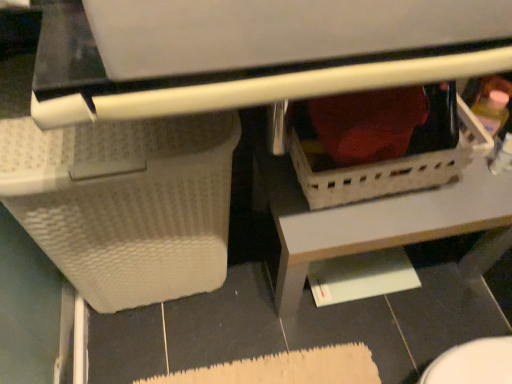
The height and width of the screenshot is (384, 512). In order to click on free point to the right of white textured basket at lower left, which appears as the second basket when viewed from the right in this screenshot , I will do `click(270, 316)`.